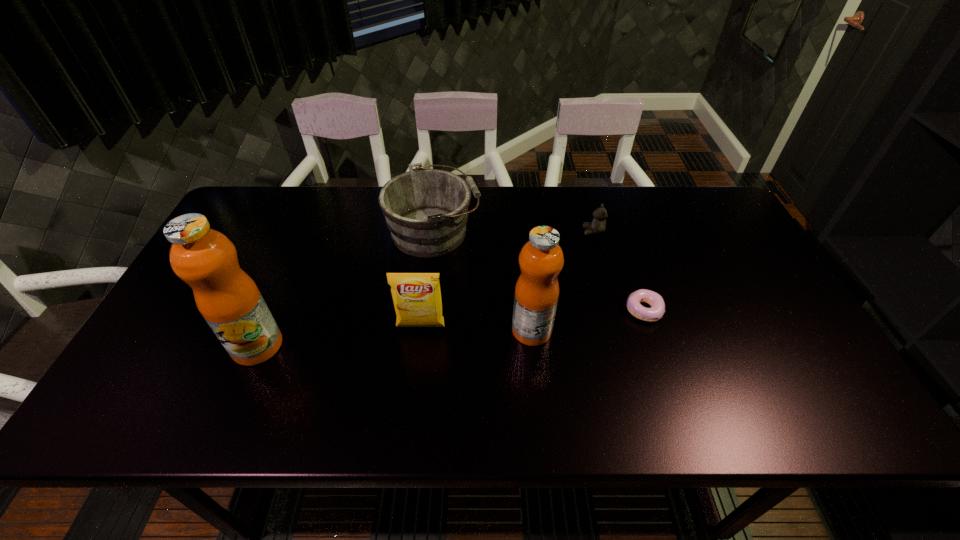
The width and height of the screenshot is (960, 540). Find the location of `free space between the right fruit juice and the crisp (potato chip)`. free space between the right fruit juice and the crisp (potato chip) is located at coordinates (476, 329).

Identify the location of vacant area that lies between the tallest object and the crisp (potato chip). This screenshot has width=960, height=540. (339, 336).

Locate which object ranks fourth in proximity to the leftmost object. Please provide its 2D coordinates. Your answer should be formatted as a tuple, i.e. [(x, y)], where the tuple contains the x and y coordinates of a point satisfying the conditions above.

[(655, 313)]

At what (x,y) coordinates should I click in order to perform the action: click on object that is the second closest one to the wine bucket. Please return your answer as a coordinate pair (x, y). The width and height of the screenshot is (960, 540). Looking at the image, I should click on (417, 300).

Find the location of `free spot that satisfies the following two spatial constraints: 1. on the face of the teddy bear; 2. on the front of the crisp (potato chip) with the logo`. free spot that satisfies the following two spatial constraints: 1. on the face of the teddy bear; 2. on the front of the crisp (potato chip) with the logo is located at coordinates (619, 327).

Locate an element on the screen. vacant space that satisfies the following two spatial constraints: 1. on the face of the teddy bear; 2. on the front side of the shorter fruit juice is located at coordinates (620, 330).

At what (x,y) coordinates should I click in order to perform the action: click on free location that satisfies the following two spatial constraints: 1. on the face of the shortest object; 2. on the right side of the teddy bear. Please return your answer as a coordinate pair (x, y). This screenshot has height=540, width=960. Looking at the image, I should click on (614, 309).